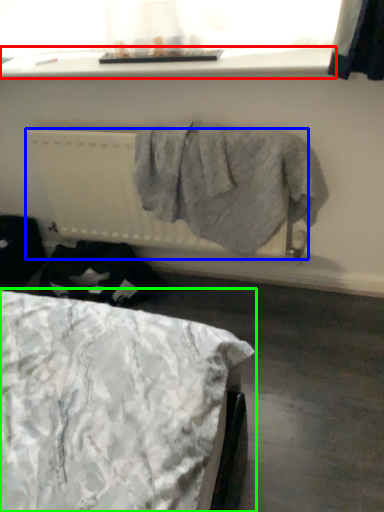
Question: Estimate the real-world distances between objects in this image. Which object is farther from window sill (highlighted by a red box), radiator (highlighted by a blue box) or bed (highlighted by a green box)?

Choices:
 (A) radiator
 (B) bed

Answer: (B)